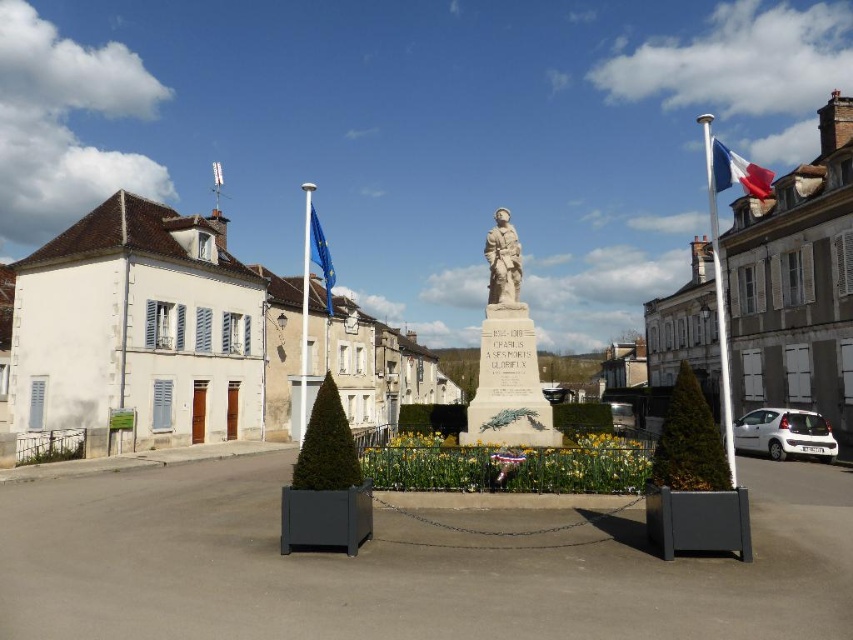
Question: In this image, where is white stone statue at center located relative to european union flag at center?

Choices:
 (A) right
 (B) left

Answer: (A)

Question: Estimate the real-world distances between objects in this image. Which object is closer to the white stone soldier at center?

Choices:
 (A) white stone building at center
 (B) european union flag at center

Answer: (A)

Question: Does blue fabric flag at upper right have a larger size compared to european union flag at center?

Choices:
 (A) no
 (B) yes

Answer: (B)

Question: Is blue fabric flag at upper right closer to camera compared to european union flag at center?

Choices:
 (A) no
 (B) yes

Answer: (B)

Question: Based on their relative distances, which object is nearer to the white stone statue at center?

Choices:
 (A) european union flag at center
 (B) white stone soldier at center

Answer: (B)

Question: Which object appears closest to the camera in this image?

Choices:
 (A) white stone building at center
 (B) blue fabric flag at upper right

Answer: (B)